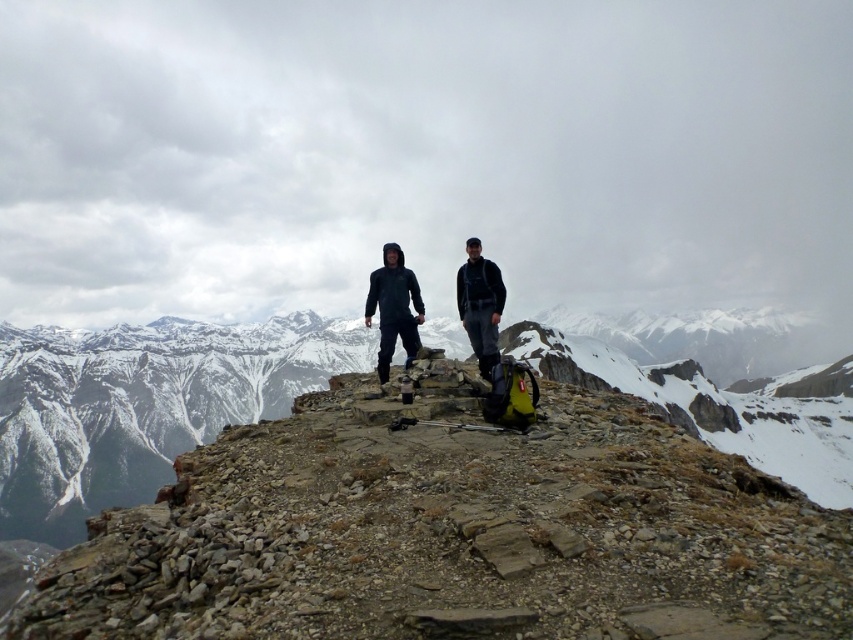
Describe the element at coordinates (421, 492) in the screenshot. This screenshot has height=640, width=853. I see `rugged stone summit at center` at that location.

Can you confirm if rugged stone summit at center is positioned to the right of dark gray hooded jacket at center?

Incorrect, rugged stone summit at center is not on the right side of dark gray hooded jacket at center.

Who is more distant from viewer, (427, 451) or (494, 332)?

Point (494, 332)

The image size is (853, 640). I want to click on rugged stone summit at center, so click(421, 492).

Can you confirm if matte black jacket at center is taller than dark gray hooded jacket at center?

In fact, matte black jacket at center may be shorter than dark gray hooded jacket at center.

Does matte black jacket at center appear on the right side of dark gray hooded jacket at center?

In fact, matte black jacket at center is to the left of dark gray hooded jacket at center.

Which is behind, point (396, 269) or point (480, 276)?

The point (396, 269) is behind.

The image size is (853, 640). Find the location of `matte black jacket at center`. matte black jacket at center is located at coordinates (393, 307).

Locate an element on the screen. This screenshot has height=640, width=853. rugged stone summit at center is located at coordinates (421, 492).

In the scene shown: Is rugged stone summit at center taller than matte black jacket at center?

Indeed, rugged stone summit at center has a greater height compared to matte black jacket at center.

Between point (535, 605) and point (401, 337), which one is positioned behind?

Positioned behind is point (401, 337).

The height and width of the screenshot is (640, 853). What are the coordinates of `rugged stone summit at center` in the screenshot? It's located at (421, 492).